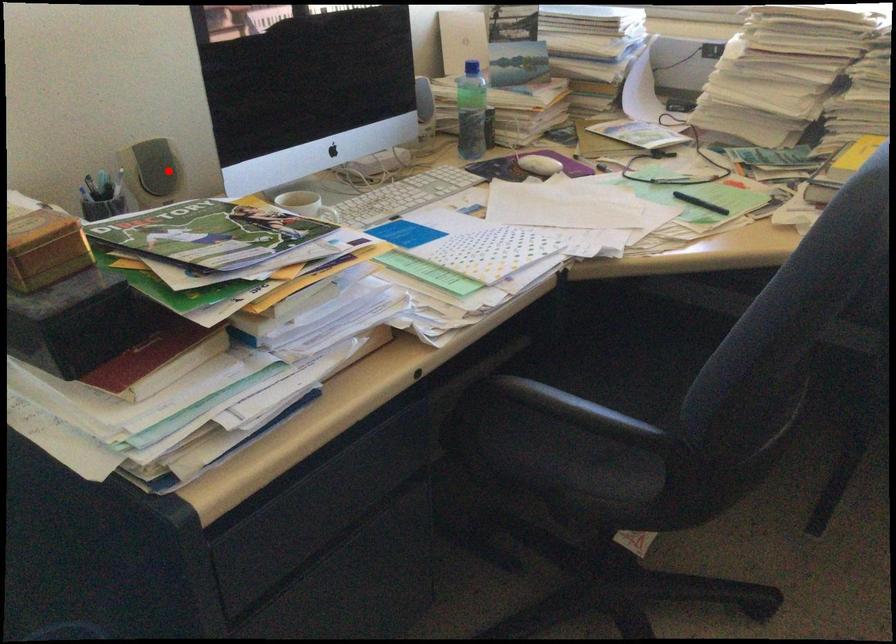
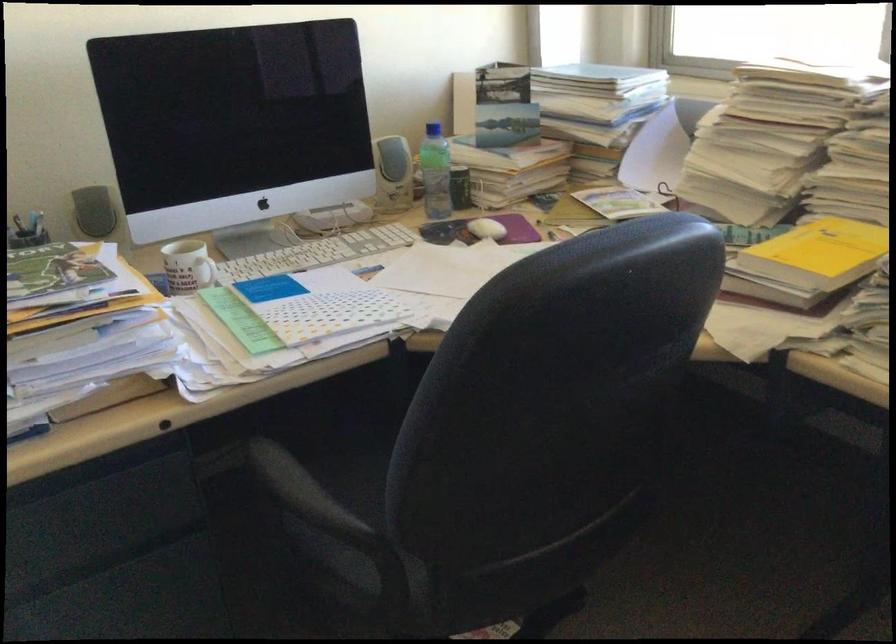
Locate, in the second image, the point that corresponds to the highlighted location in the first image.

(93, 211)